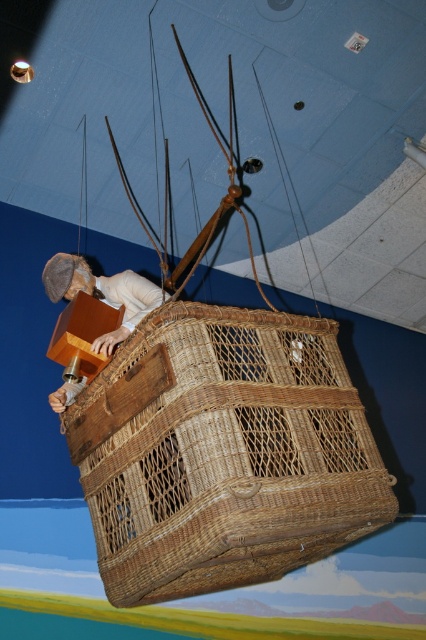
Can you confirm if woven brown basket at center is smaller than wooden figure at center?

Incorrect, woven brown basket at center is not smaller in size than wooden figure at center.

Where is `woven brown basket at center`? woven brown basket at center is located at coordinates (222, 452).